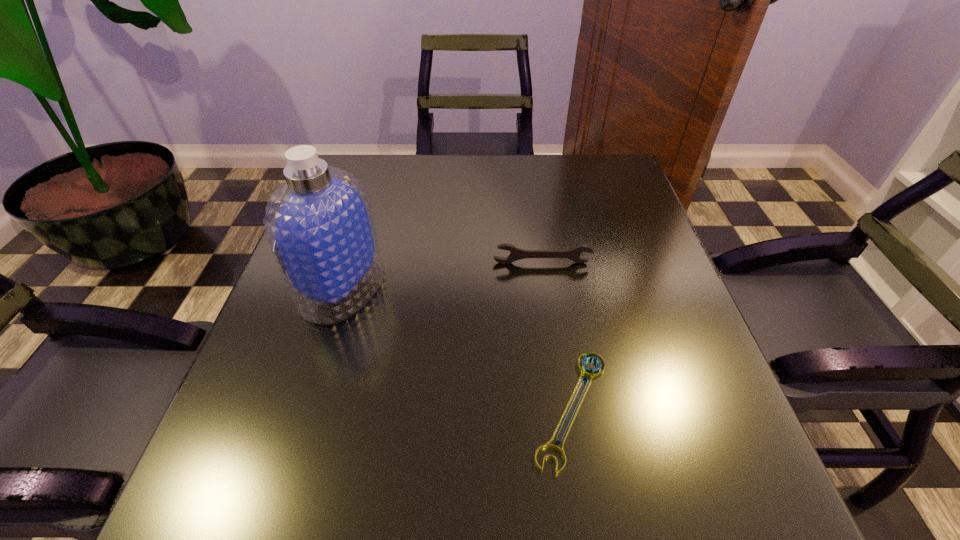
Find the location of a particular element. vacant space that satisfies the following two spatial constraints: 1. on the open ends of the shorter wrench; 2. on the left side of the second tallest object is located at coordinates (x=563, y=409).

Identify the location of free space that satisfies the following two spatial constraints: 1. on the open ends of the nearest object; 2. on the left side of the farther wrench. The height and width of the screenshot is (540, 960). (563, 409).

I want to click on free spot that satisfies the following two spatial constraints: 1. on the open ends of the shorter wrench; 2. on the left side of the farther wrench, so click(x=563, y=409).